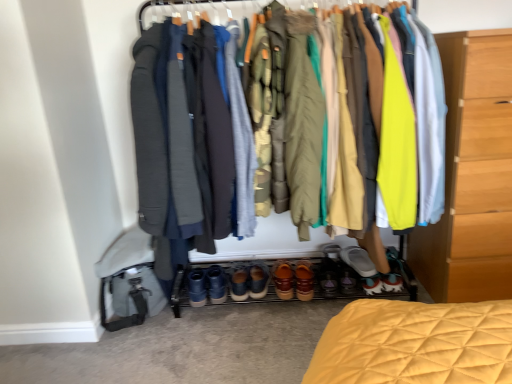
Question: From a real-world perspective, does dark gray fabric robe at center, the first robe in the left-to-right sequence, stand above brown leather shoes at center, which appears as the third footwear when viewed from the left?

Choices:
 (A) yes
 (B) no

Answer: (A)

Question: Could you tell me if dark gray fabric robe at center, the first robe in the left-to-right sequence, is facing brown leather shoes at center, arranged as the 4th footwear when viewed from the right?

Choices:
 (A) no
 (B) yes

Answer: (A)

Question: Is dark gray fabric robe at center, the first robe in the left-to-right sequence, thinner than brown leather shoes at center, arranged as the 4th footwear when viewed from the right?

Choices:
 (A) no
 (B) yes

Answer: (A)

Question: Is dark gray fabric robe at center, the fourth robe positioned from the right, at the right side of brown leather shoes at center, which appears as the third footwear when viewed from the left?

Choices:
 (A) no
 (B) yes

Answer: (A)

Question: Can you confirm if dark gray fabric robe at center, the fourth robe positioned from the right, is bigger than brown leather shoes at center, arranged as the 4th footwear when viewed from the right?

Choices:
 (A) yes
 (B) no

Answer: (A)

Question: From the image's perspective, is dark gray fabric robe at center, the first robe in the left-to-right sequence, under brown leather shoes at center, arranged as the 4th footwear when viewed from the right?

Choices:
 (A) yes
 (B) no

Answer: (B)

Question: Is dark gray fabric robe at center, the first robe in the left-to-right sequence, beside leather brown shoes at center, which is counted as the 5th footwear, starting from the left?

Choices:
 (A) yes
 (B) no

Answer: (B)

Question: Considering the relative sizes of dark gray fabric robe at center, the first robe in the left-to-right sequence, and leather brown shoes at center, which is counted as the 5th footwear, starting from the left, in the image provided, is dark gray fabric robe at center, the first robe in the left-to-right sequence, smaller than leather brown shoes at center, which is counted as the 5th footwear, starting from the left,?

Choices:
 (A) no
 (B) yes

Answer: (A)

Question: Is dark gray fabric robe at center, the fourth robe positioned from the right, taller than leather brown shoes at center, the second footwear positioned from the right?

Choices:
 (A) yes
 (B) no

Answer: (A)

Question: Can you confirm if dark gray fabric robe at center, the first robe in the left-to-right sequence, is positioned to the right of leather brown shoes at center, the second footwear positioned from the right?

Choices:
 (A) no
 (B) yes

Answer: (A)

Question: Is dark gray fabric robe at center, the fourth robe positioned from the right, at the left side of leather brown shoes at center, the second footwear positioned from the right?

Choices:
 (A) yes
 (B) no

Answer: (A)

Question: Is dark gray fabric robe at center, the fourth robe positioned from the right, in front of leather brown shoes at center, which is counted as the 5th footwear, starting from the left?

Choices:
 (A) yes
 (B) no

Answer: (A)

Question: Is light wood chest of drawers at right not close to gray wool robe at center, which is the second robe from right to left?

Choices:
 (A) yes
 (B) no

Answer: (B)